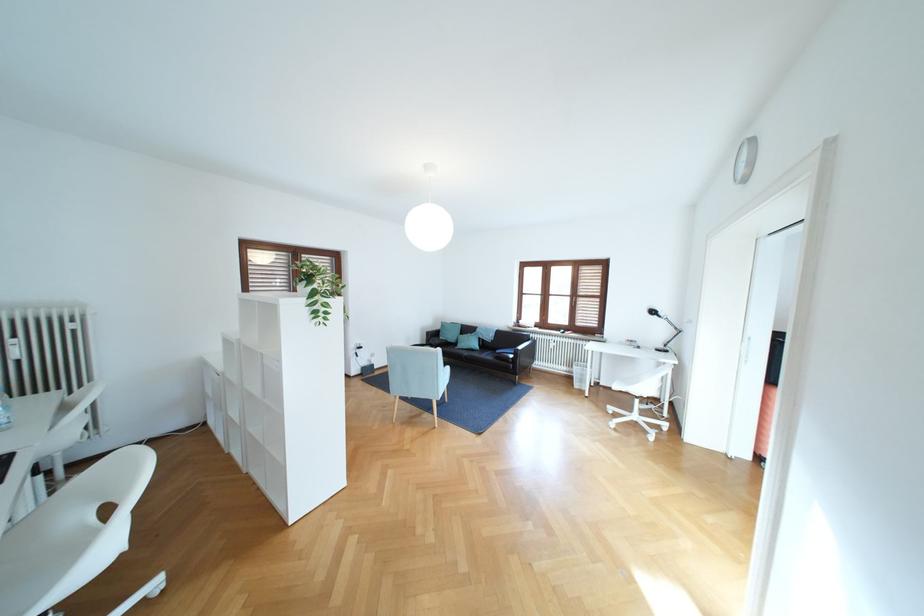
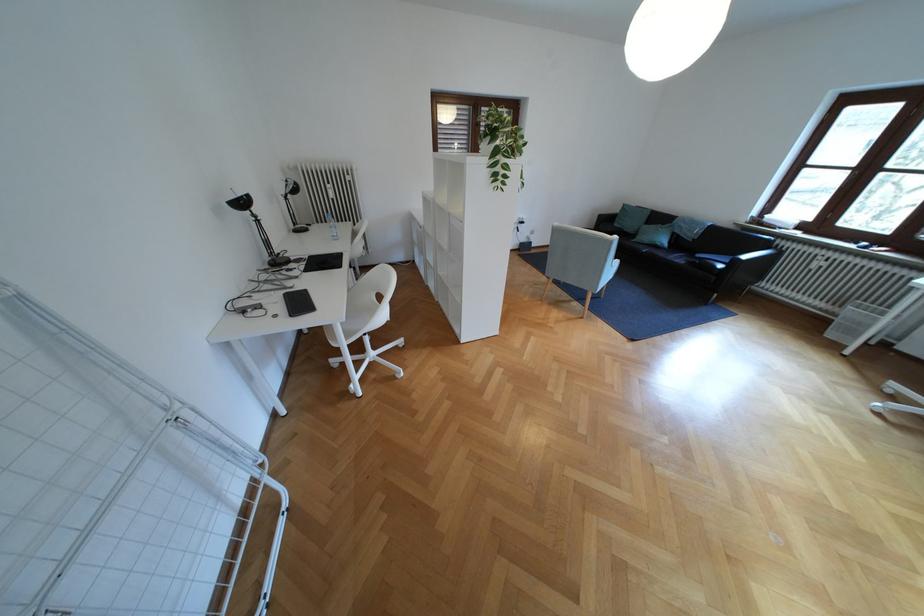
Question: I am providing you with two images of the same scene from different viewpoints. After the viewpoint changes to image2, which objects are now occluded?

Choices:
 (A) plastic water bottle
 (B) black lamp head
 (C) black sofa armrest
 (D) none of these

Answer: (D)